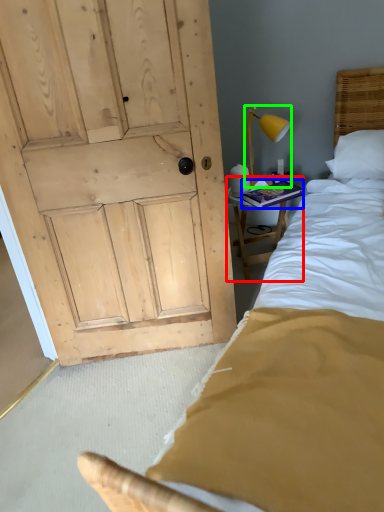
Question: Which object is the closest to the furniture (highlighted by a red box)? Choose among these: book (highlighted by a blue box) or bedside lamp (highlighted by a green box).

Choices:
 (A) book
 (B) bedside lamp

Answer: (A)